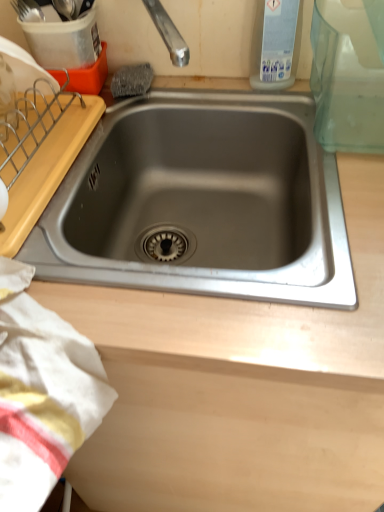
Question: Considering the positions of point (324, 164) and point (274, 11), is point (324, 164) closer or farther from the camera than point (274, 11)?

Choices:
 (A) farther
 (B) closer

Answer: (B)

Question: From their relative heights in the image, would you say stainless steel sink at center is taller or shorter than transparent plastic bottle at upper right?

Choices:
 (A) tall
 (B) short

Answer: (B)

Question: Estimate the real-world distances between objects in this image. Which object is farther from the transparent plastic bottle at upper right?

Choices:
 (A) white cotton towel at lower left
 (B) stainless steel sink at center

Answer: (A)

Question: Which object is positioned farthest from the stainless steel sink at center?

Choices:
 (A) transparent plastic bottle at upper right
 (B) white cotton towel at lower left

Answer: (B)